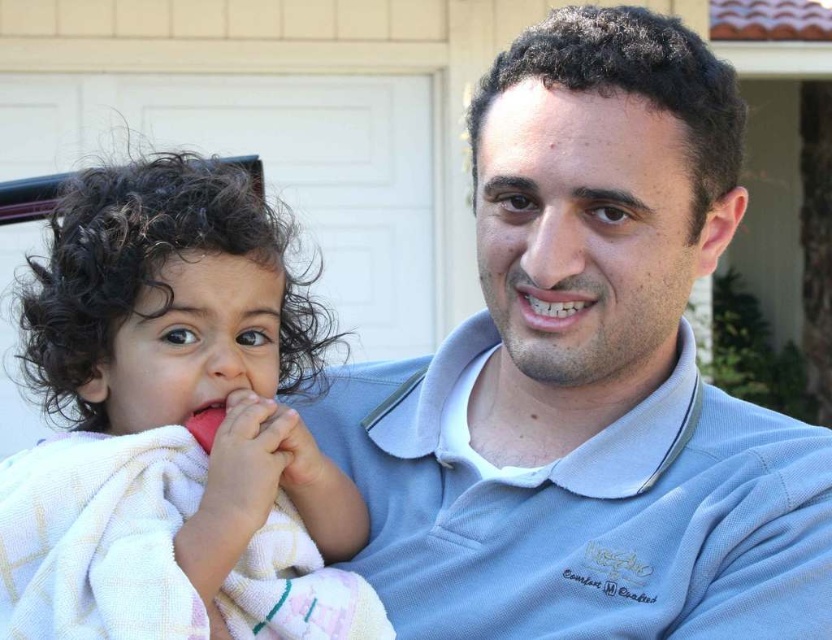
Is light blue cotton polo shirt at center bigger than dark curly hair at upper center?

Yes.

Who is more distant from viewer, [602,488] or [565,74]?

The point [602,488] is behind.

At what (x,y) coordinates should I click in order to perform the action: click on light blue cotton polo shirt at center. Please return your answer as a coordinate pair (x, y). The image size is (832, 640). Looking at the image, I should click on (583, 509).

Is the position of dark curly hair at upper center more distant than that of white glossy teeth at center?

No, it is in front of white glossy teeth at center.

Image resolution: width=832 pixels, height=640 pixels. Describe the element at coordinates (631, 83) in the screenshot. I see `dark curly hair at upper center` at that location.

The image size is (832, 640). I want to click on dark curly hair at upper center, so click(x=631, y=83).

Between curly-haired baby at left and white glossy teeth at center, which one has less height?

white glossy teeth at center is shorter.

Find the location of a particular element. This screenshot has height=640, width=832. curly-haired baby at left is located at coordinates (176, 422).